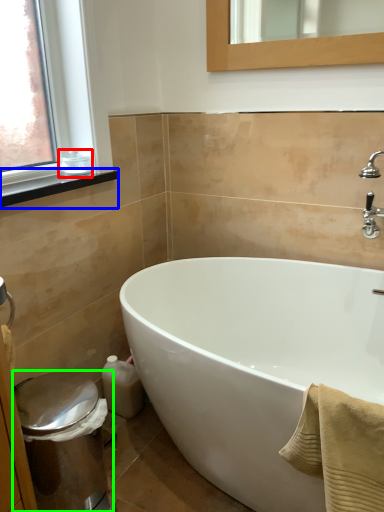
Question: Which object is positioned farthest from toiletry (highlighted by a red box)? Select from window sill (highlighted by a blue box) and bidet (highlighted by a green box).

Choices:
 (A) window sill
 (B) bidet

Answer: (B)